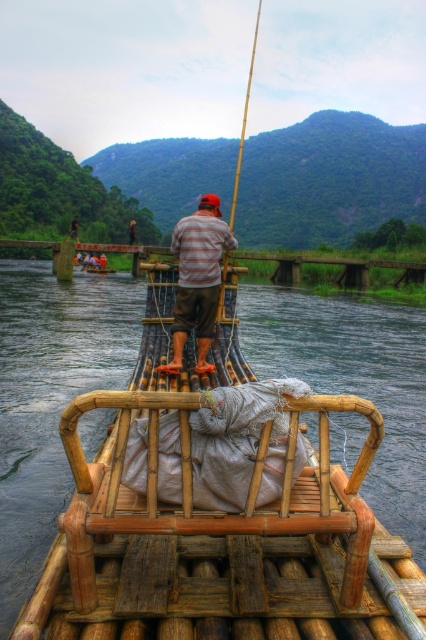
You are a passenger on the brown wooden raft at center. You want to move to the point at coordinate point (51,397). Is this point on your current raft?

The point at coordinate point (51,397) is where the brown wooden raft at center is located, so yes, this point is on your current raft.

You are on a bamboo raft trip and need to secure your belongings. You have a backpack and a camera. Where should you place them to ensure they won not fall into the water? Consider the positions of the brown wooden raft at center and the striped fabric shirt at center.

The brown wooden raft at center is positioned under the striped fabric shirt at center, which suggests the shirt is above the raft. To secure your belongings safely, place them on the brown wooden raft at center near the center area where the striped fabric shirt at center is not obstructing, ensuring they are away from the edges to prevent falling into the water.

You are a photographer aiming to capture the brown wooden raft at center and the striped fabric shirt at center in a single frame. Given that the camera can only focus on one object at a time, which object should you prioritize focusing on to ensure it appears larger in the photo?

You should prioritize focusing on the brown wooden raft at center because it is bigger than the striped fabric shirt at center, so it will appear larger in the photo.